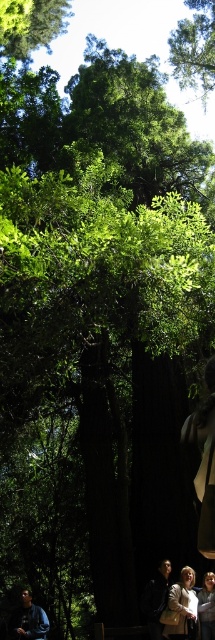
Is white fabric jacket at lower center thinner than light brown leather jacket at lower right?

In fact, white fabric jacket at lower center might be wider than light brown leather jacket at lower right.

Does point (181, 588) come in front of point (201, 595)?

That is True.

Identify the location of white fabric jacket at lower center. (182, 605).

Can you confirm if white fabric jacket at lower center is positioned to the left of blue denim jacket at lower left?

No, white fabric jacket at lower center is not to the left of blue denim jacket at lower left.

Measure the distance between white fabric jacket at lower center and camera.

29.59 feet

Measure the distance between point (179, 589) and camera.

Point (179, 589) and camera are 9.57 meters apart.

You are a GUI agent. You are given a task and a screenshot of the screen. Output one action in this format:
    pyautogui.click(x=<x>, y=<y>)
    Task: Click on the white fabric jacket at lower center
    The width and height of the screenshot is (215, 640).
    Given the screenshot: What is the action you would take?
    pyautogui.click(x=182, y=605)

Does blue denim jacket at lower left appear under light brown leather jacket at lower right?

Yes.

Based on the photo, who is higher up, blue denim jacket at lower left or light brown leather jacket at lower right?

light brown leather jacket at lower right is higher up.

The image size is (215, 640). Identify the location of blue denim jacket at lower left. (29, 620).